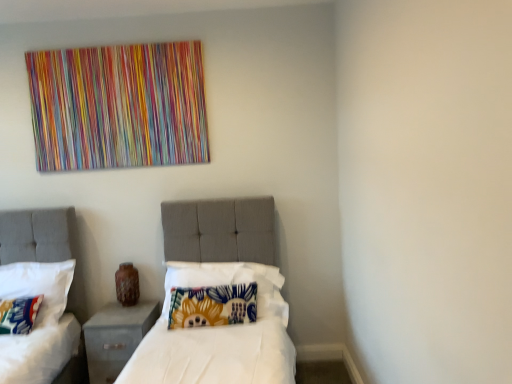
Question: From the image's perspective, is fluffy multicolored pillow at lower left, placed as the third pillow when sorted from right to left, located above or below floral fabric pillow at left, positioned as the second pillow in left-to-right order?

Choices:
 (A) above
 (B) below

Answer: (B)

Question: From a real-world perspective, is fluffy multicolored pillow at lower left, arranged as the first pillow when viewed from the left, above or below floral fabric pillow at left, the second pillow positioned from the right?

Choices:
 (A) above
 (B) below

Answer: (B)

Question: Which of these objects is positioned closest to the floral fabric pillow at left, positioned as the second pillow in left-to-right order?

Choices:
 (A) fluffy multicolored pillow at lower left, placed as the third pillow when sorted from right to left
 (B) gray fabric nightstand at lower left
 (C) floral fabric pillow at center, which appears as the first pillow when viewed from the right

Answer: (A)

Question: Based on their relative distances, which object is farther from the floral fabric pillow at left, the second pillow positioned from the right?

Choices:
 (A) floral fabric pillow at center, the third pillow positioned from the left
 (B) gray fabric nightstand at lower left
 (C) fluffy multicolored pillow at lower left, arranged as the first pillow when viewed from the left

Answer: (A)